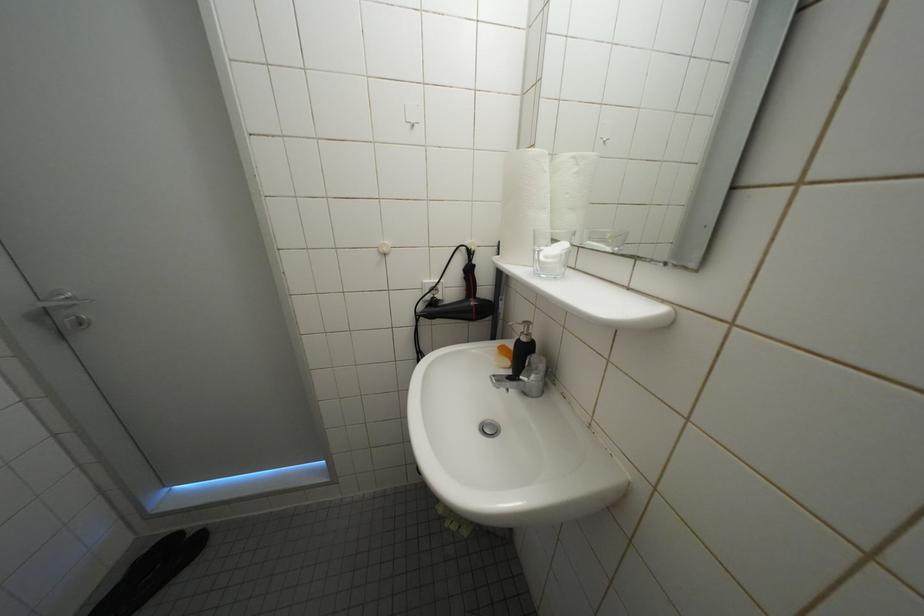
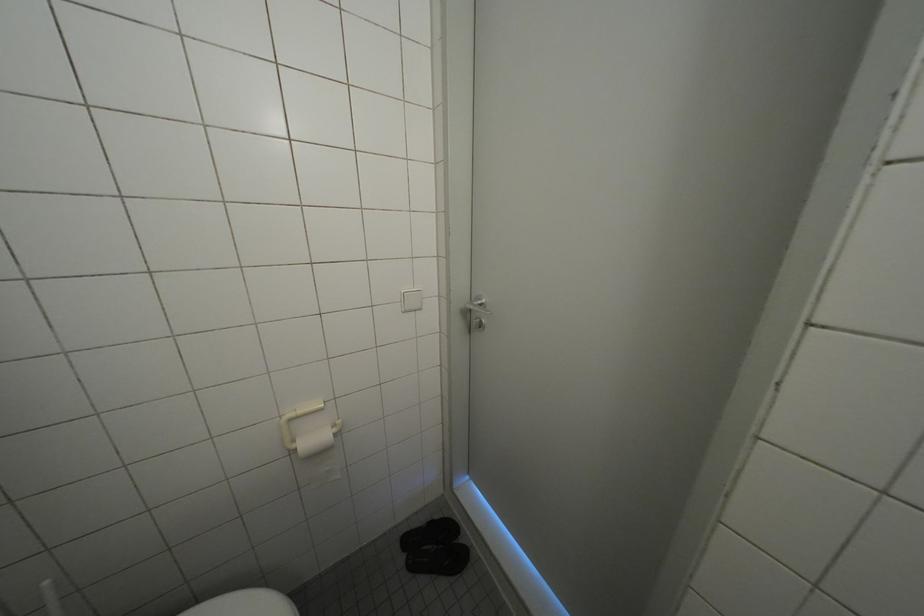
Question: The camera is either moving clockwise (left) or counter-clockwise (right) around the object. The first image is from the beginning of the video and the second image is from the end. Is the camera moving left or right when shooting the video?

Choices:
 (A) Left
 (B) Right

Answer: (B)